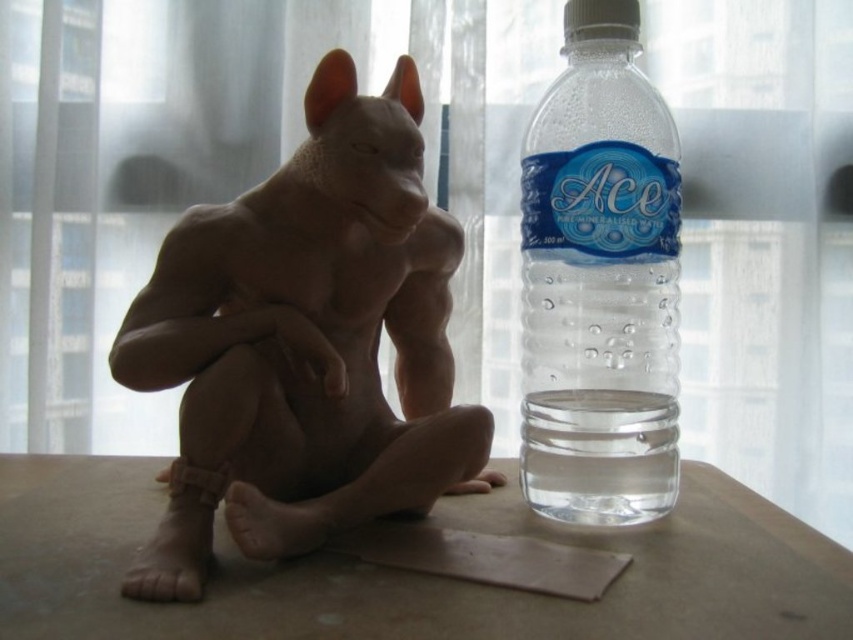
Can you confirm if matte brown statue at center is positioned to the right of clear plastic bottle at right?

No, matte brown statue at center is not to the right of clear plastic bottle at right.

Does matte brown statue at center appear over clear plastic bottle at right?

No.

I want to click on matte brown statue at center, so click(306, 342).

Locate an element on the screen. matte brown statue at center is located at coordinates (306, 342).

Does matte brown statue at center lie behind matte brown table at lower center?

Yes.

Can you confirm if matte brown statue at center is positioned below matte brown table at lower center?

No.

The width and height of the screenshot is (853, 640). In order to click on matte brown statue at center in this screenshot , I will do `click(306, 342)`.

Between matte brown table at lower center and clear plastic bottle at right, which one appears on the right side from the viewer's perspective?

clear plastic bottle at right

The height and width of the screenshot is (640, 853). Find the location of `matte brown table at lower center`. matte brown table at lower center is located at coordinates (412, 573).